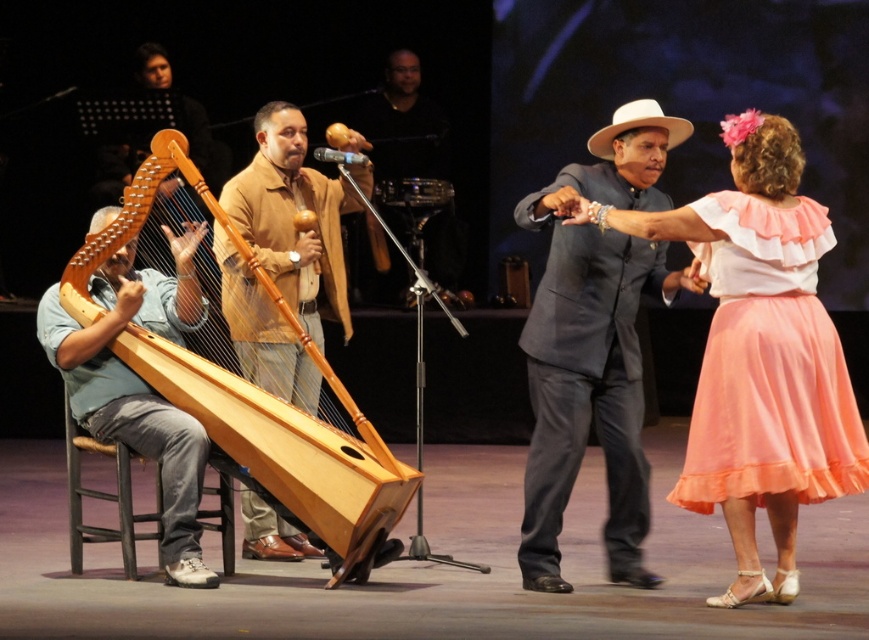
You are a stagehand setting up for a performance. You need to place a new stand that requires 1 meter of space between the wooden harp at center and the wooden harp at left. Given their sizes, is there enough space between them?

The wooden harp at center is smaller than the wooden harp at left, but the exact distance between them isn

What is located at the coordinates point (760, 353)?

The pink satin skirt at center is located at point (760, 353).

Based on the scene description, where is the wooden harp at center located in terms of coordinates?

The wooden harp at center is located at point coordinates of (292, 218).